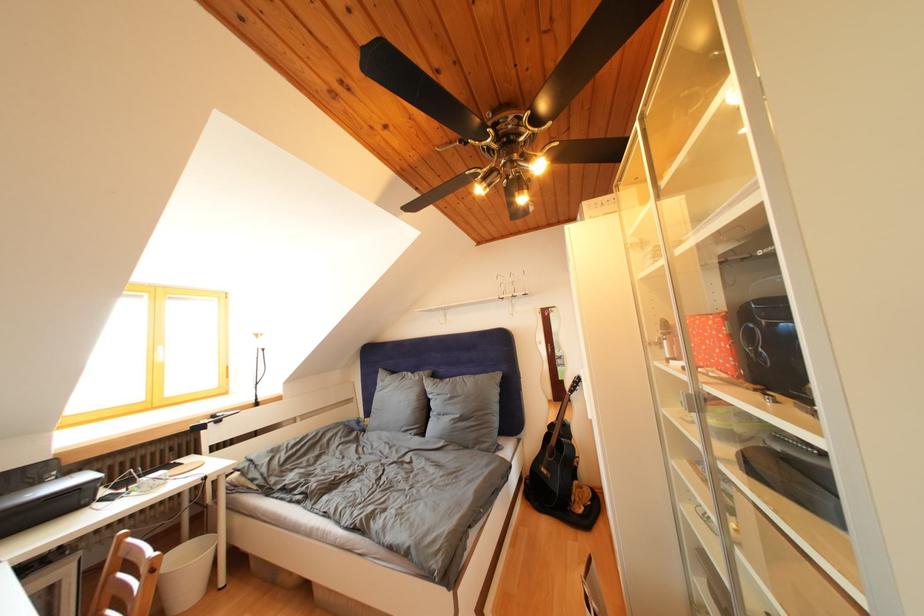
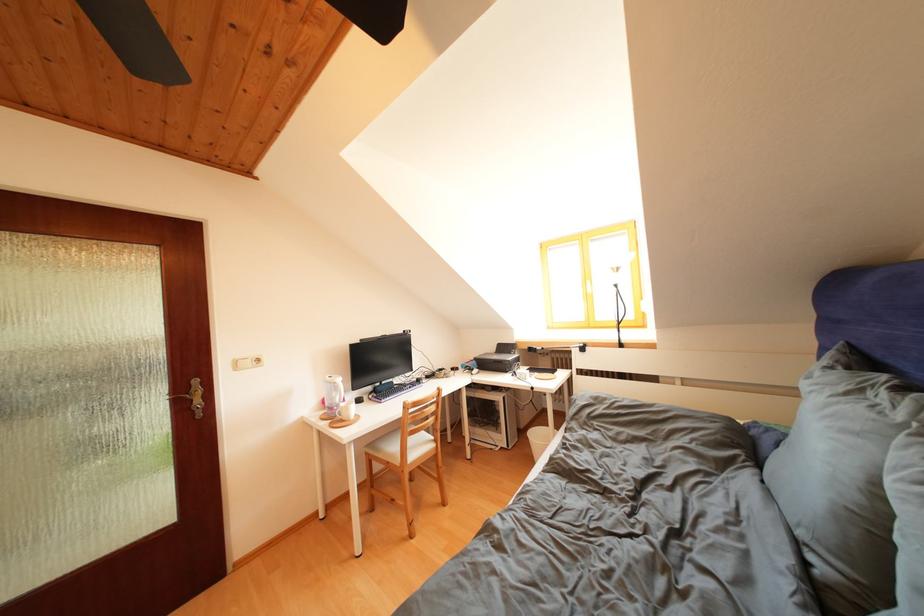
In the second image, find the point that corresponds to the point at 44,488 in the first image.

(517, 358)